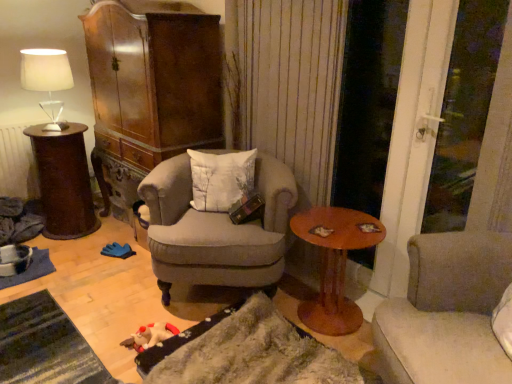
Question: Does dark brown wooden side table at left, acting as the 1th table starting from the left, come behind wooden round table at center, acting as the 2th table starting from the back?

Choices:
 (A) yes
 (B) no

Answer: (A)

Question: Is dark brown wooden side table at left, arranged as the second table when viewed from the front, smaller than wooden round table at center, acting as the 1th table starting from the right?

Choices:
 (A) yes
 (B) no

Answer: (B)

Question: Is dark brown wooden side table at left, positioned as the 1th table in back-to-front order, surrounding wooden round table at center, acting as the 2th table starting from the back?

Choices:
 (A) no
 (B) yes

Answer: (A)

Question: From the image's perspective, would you say dark brown wooden side table at left, positioned as the 1th table in back-to-front order, is positioned over wooden round table at center, acting as the 2th table starting from the back?

Choices:
 (A) yes
 (B) no

Answer: (A)

Question: Does dark brown wooden side table at left, which is counted as the second table, starting from the right, have a lesser width compared to wooden round table at center, which ranks as the second table in left-to-right order?

Choices:
 (A) no
 (B) yes

Answer: (B)

Question: Is dark brown wooden side table at left, which is counted as the second table, starting from the right, taller or shorter than fuzzy fabric blanket at lower center?

Choices:
 (A) tall
 (B) short

Answer: (A)

Question: Is dark brown wooden side table at left, positioned as the 1th table in back-to-front order, situated inside fuzzy fabric blanket at lower center or outside?

Choices:
 (A) inside
 (B) outside

Answer: (B)

Question: Looking at the image, does dark brown wooden side table at left, arranged as the second table when viewed from the front, seem bigger or smaller compared to fuzzy fabric blanket at lower center?

Choices:
 (A) small
 (B) big

Answer: (B)

Question: Considering the relative positions of dark brown wooden side table at left, arranged as the second table when viewed from the front, and fuzzy fabric blanket at lower center in the image provided, is dark brown wooden side table at left, arranged as the second table when viewed from the front, to the left or to the right of fuzzy fabric blanket at lower center?

Choices:
 (A) right
 (B) left

Answer: (B)

Question: Looking at the image, does dark brown wooden side table at left, positioned as the 1th table in back-to-front order, seem bigger or smaller compared to white textured pillow at center?

Choices:
 (A) small
 (B) big

Answer: (B)

Question: Looking at their shapes, would you say dark brown wooden side table at left, arranged as the second table when viewed from the front, is wider or thinner than white textured pillow at center?

Choices:
 (A) wide
 (B) thin

Answer: (A)

Question: Does point coord(53,211) appear closer or farther from the camera than point coord(220,160)?

Choices:
 (A) farther
 (B) closer

Answer: (A)

Question: From the image's perspective, is dark brown wooden side table at left, arranged as the second table when viewed from the front, located above or below white textured pillow at center?

Choices:
 (A) above
 (B) below

Answer: (A)

Question: Is fuzzy fabric blanket at lower center to the left or to the right of dark brown wooden side table at left, positioned as the 1th table in back-to-front order, in the image?

Choices:
 (A) right
 (B) left

Answer: (A)

Question: From the image's perspective, is fuzzy fabric blanket at lower center above or below dark brown wooden side table at left, arranged as the second table when viewed from the front?

Choices:
 (A) below
 (B) above

Answer: (A)